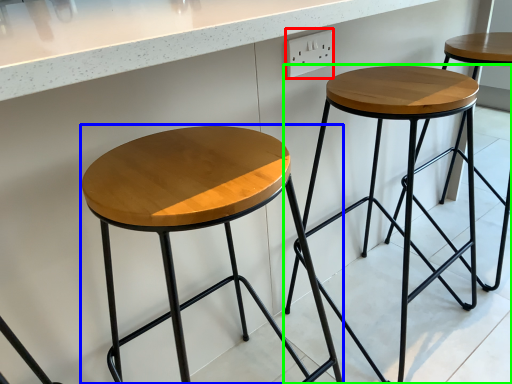
Question: Considering the real-world distances, which object is farthest from electric outlet (highlighted by a red box)? stool (highlighted by a blue box) or stool (highlighted by a green box)?

Choices:
 (A) stool
 (B) stool

Answer: (A)